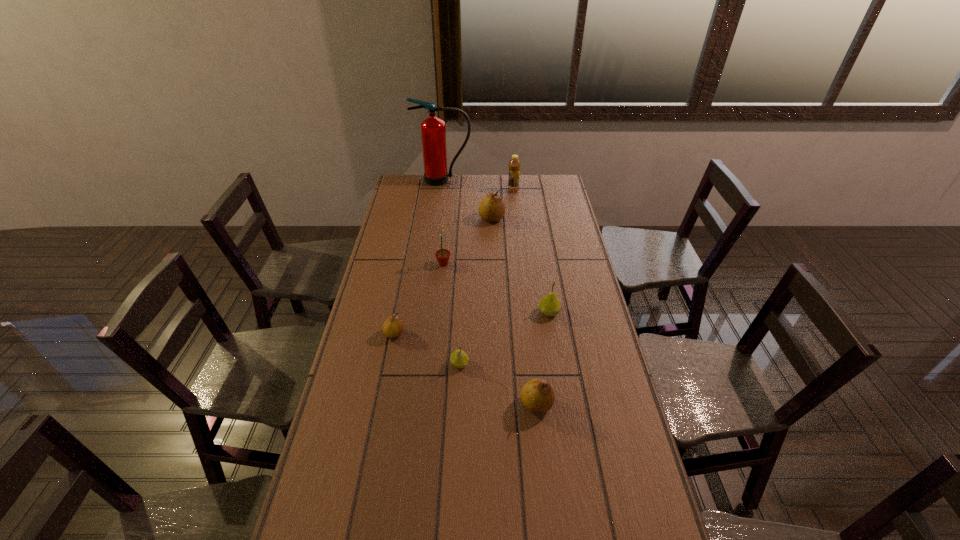
The image size is (960, 540). Find the location of `fire extinguisher`. fire extinguisher is located at coordinates (433, 131).

Image resolution: width=960 pixels, height=540 pixels. Identify the location of the farthest object. (433, 131).

The image size is (960, 540). I want to click on the second farthest object, so click(x=514, y=165).

The image size is (960, 540). I want to click on the fourth farthest object, so click(x=442, y=255).

The height and width of the screenshot is (540, 960). I want to click on sunflower, so tap(442, 255).

Locate an element on the screen. This screenshot has width=960, height=540. the second brown pear from right to left is located at coordinates (491, 208).

Where is `the tallest pear`? Image resolution: width=960 pixels, height=540 pixels. the tallest pear is located at coordinates (491, 208).

Find the location of a particular element. the farther green pear is located at coordinates (549, 305).

Where is `the right green pear`? the right green pear is located at coordinates (549, 305).

Locate an element on the screen. the rightmost brown pear is located at coordinates (537, 395).